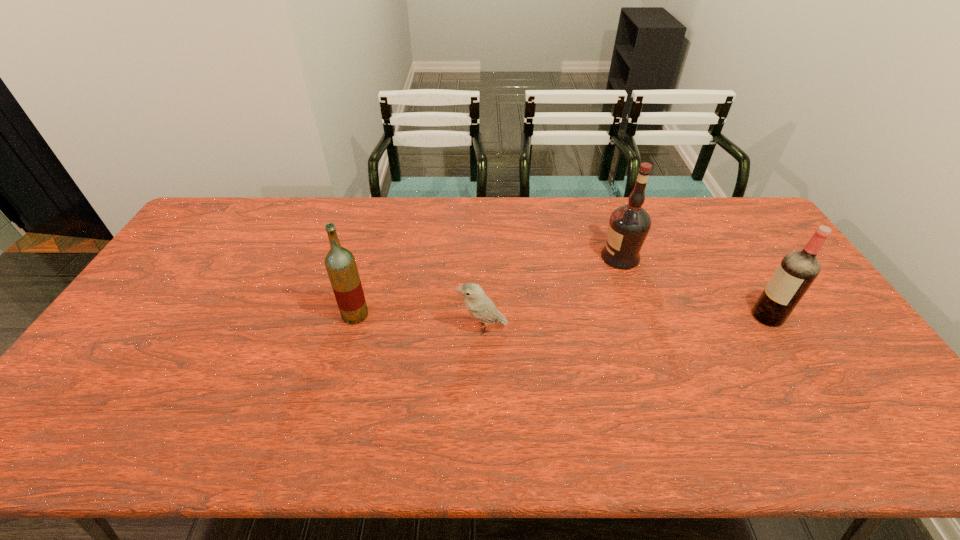
The height and width of the screenshot is (540, 960). Identify the location of free spot between the second liquor from left to right and the rightmost liquor. coord(694,287).

The height and width of the screenshot is (540, 960). What are the coordinates of `vacant point located between the rightmost liquor and the second liquor from left to right` in the screenshot? It's located at (694, 287).

Identify which object is the second closest to the rightmost object. Please provide its 2D coordinates. Your answer should be formatted as a tuple, i.e. [(x, y)], where the tuple contains the x and y coordinates of a point satisfying the conditions above.

[(479, 305)]

This screenshot has width=960, height=540. In order to click on object that is the closest to the shortest object in this screenshot , I will do `click(340, 263)`.

Where is `liquor that is the second closest one to the leftmost object`? liquor that is the second closest one to the leftmost object is located at coordinates (797, 271).

Identify which liquor is the second closest to the leftmost liquor. Please provide its 2D coordinates. Your answer should be formatted as a tuple, i.e. [(x, y)], where the tuple contains the x and y coordinates of a point satisfying the conditions above.

[(797, 271)]